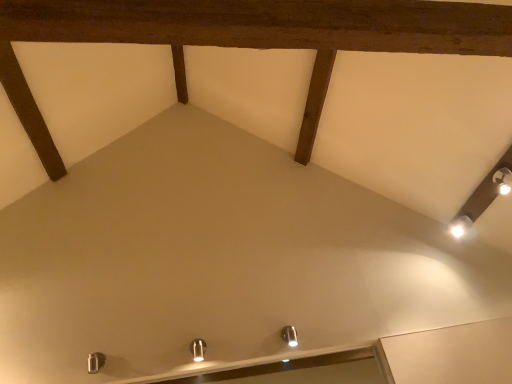
Question: Considering the positions of metallic silver light fixture at center, marked as the 1th light fixture in a bottom-to-top arrangement, and satin nickel light fixture at lower center, the second light fixture when ordered from front to back, in the image, is metallic silver light fixture at center, marked as the 1th light fixture in a bottom-to-top arrangement, bigger or smaller than satin nickel light fixture at lower center, the second light fixture when ordered from front to back,?

Choices:
 (A) small
 (B) big

Answer: (B)

Question: Considering their positions, is metallic silver light fixture at center, which is the 3th light fixture from right to left, located in front of or behind satin nickel light fixture at lower center, acting as the 2th light fixture starting from the left?

Choices:
 (A) front
 (B) behind

Answer: (A)

Question: Which object is positioned farthest from the white glossy light fixture at upper right, which is the first light fixture from right to left?

Choices:
 (A) metallic silver light fixture at center, placed as the first light fixture when sorted from front to back
 (B) satin nickel light fixture at lower center, acting as the 2th light fixture starting from the left

Answer: (A)

Question: Which object is the closest to the white glossy light fixture at upper right, the third light fixture in the left-to-right sequence?

Choices:
 (A) metallic silver light fixture at center, positioned as the third light fixture in top-to-bottom order
 (B) satin nickel light fixture at lower center, which is the second light fixture from bottom to top

Answer: (B)